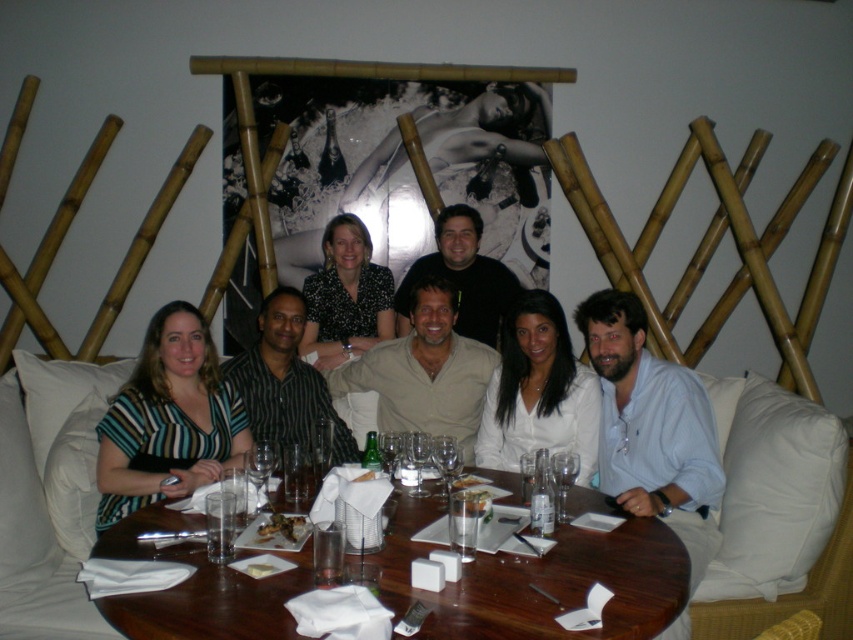
Locate an element on the screen. The height and width of the screenshot is (640, 853). white glossy shirt at center is located at coordinates (538, 392).

Describe the element at coordinates (538, 392) in the screenshot. I see `white glossy shirt at center` at that location.

Locate an element on the screen. The height and width of the screenshot is (640, 853). white glossy shirt at center is located at coordinates [538, 392].

From the picture: Does striped fabric shirt at center appear over transparent glass wine glass at table center?

Yes.

Can you confirm if striped fabric shirt at center is smaller than transparent glass wine glass at table center?

No.

The image size is (853, 640). What do you see at coordinates (650, 426) in the screenshot?
I see `striped fabric shirt at center` at bounding box center [650, 426].

At what (x,y) coordinates should I click in order to perform the action: click on striped fabric shirt at center. Please return your answer as a coordinate pair (x, y). This screenshot has width=853, height=640. Looking at the image, I should click on (650, 426).

Can you confirm if black dotted blouse at center is positioned above transparent glass wine glass at table center?

Correct, black dotted blouse at center is located above transparent glass wine glass at table center.

Does black dotted blouse at center have a greater width compared to transparent glass wine glass at table center?

Yes.

Between point (364, 340) and point (560, 499), which one is positioned behind?

Positioned behind is point (364, 340).

Where is `black dotted blouse at center`? The height and width of the screenshot is (640, 853). black dotted blouse at center is located at coordinates (346, 296).